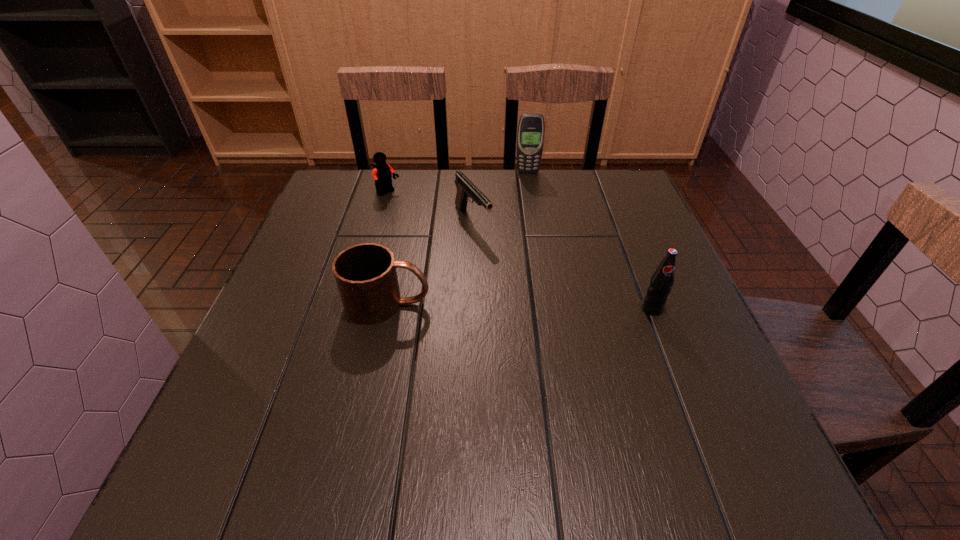
Locate an element on the screen. The height and width of the screenshot is (540, 960). mug is located at coordinates (365, 274).

Find the location of a particular element. The height and width of the screenshot is (540, 960). the second tallest object is located at coordinates 661,281.

At what (x,y) coordinates should I click in order to perform the action: click on the rightmost object. Please return your answer as a coordinate pair (x, y). This screenshot has width=960, height=540. Looking at the image, I should click on (661, 281).

The image size is (960, 540). Identify the location of the second farthest object. (382, 172).

Locate an element on the screen. the third farthest object is located at coordinates (465, 188).

This screenshot has height=540, width=960. In order to click on pistol in this screenshot , I will do `click(465, 188)`.

At what (x,y) coordinates should I click in order to perform the action: click on the fourth object from left to right. Please return your answer as a coordinate pair (x, y). Looking at the image, I should click on (530, 136).

Find the location of a particular element. The width and height of the screenshot is (960, 540). cellular telephone is located at coordinates (530, 136).

This screenshot has height=540, width=960. I want to click on blank space located 0.130m on the side of the mug with the handle, so click(492, 304).

This screenshot has height=540, width=960. I want to click on free space located on the front label of the rightmost object, so click(x=666, y=347).